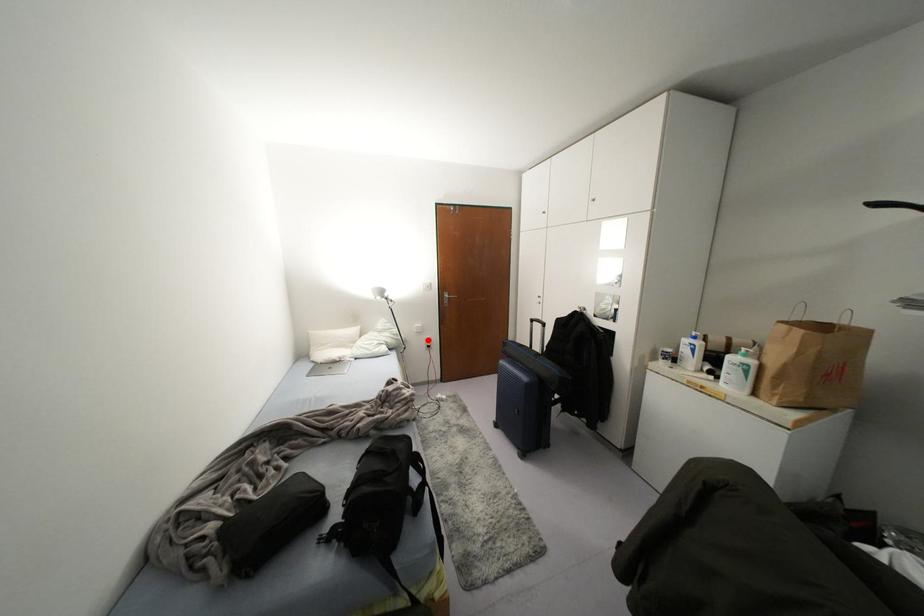
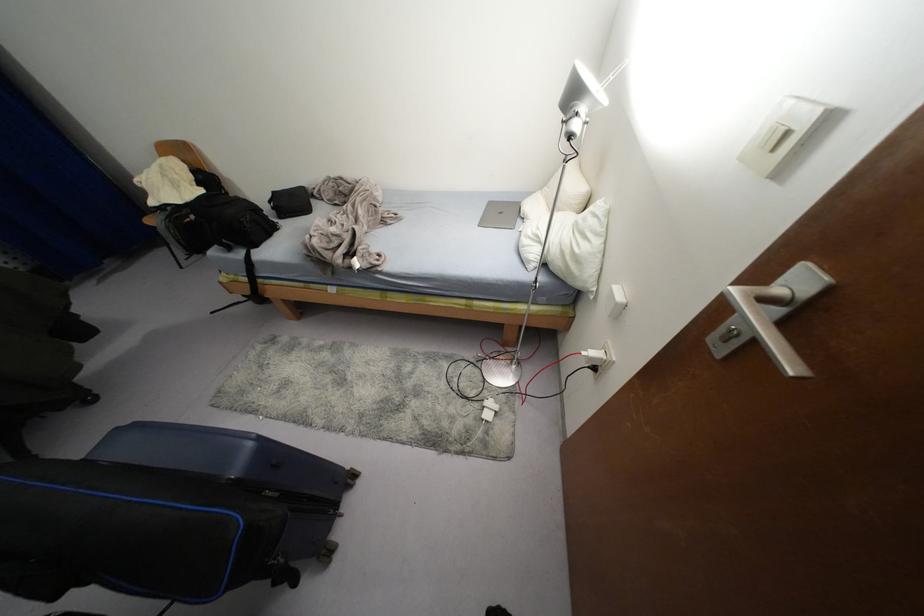
Question: I am providing you with two images of the same scene from different viewpoints. A red point is shown in image1. For the corresponding object point in image2, is it positioned nearer or farther from the camera?

Choices:
 (A) Nearer
 (B) Farther

Answer: (A)